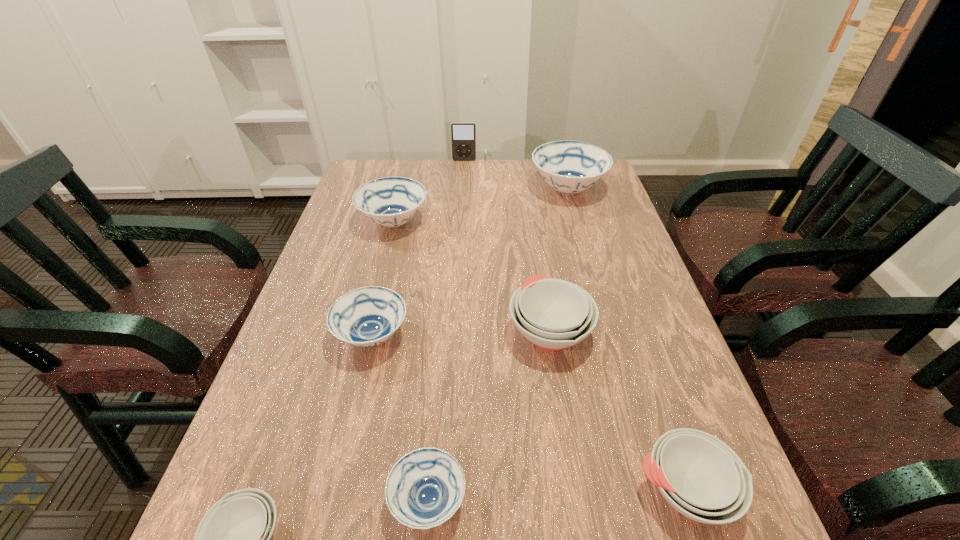
Locate an element on the screen. This screenshot has height=540, width=960. vacant space that satisfies the following two spatial constraints: 1. on the back side of the biggest white soup bowl; 2. on the left side of the third biggest blue soup bowl is located at coordinates (373, 331).